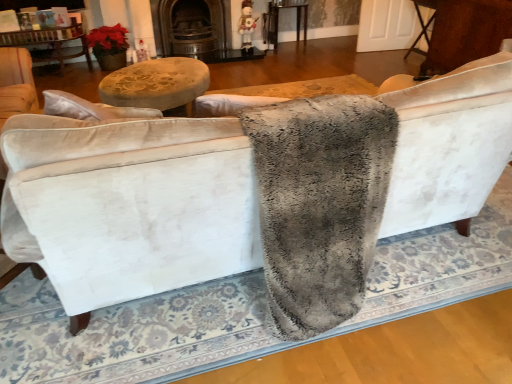
Question: Looking at their shapes, would you say gray fluffy blanket at center is wider or thinner than dark brown wood fireplace at upper center?

Choices:
 (A) thin
 (B) wide

Answer: (B)

Question: Relative to dark brown wood fireplace at upper center, is gray fluffy blanket at center in front or behind?

Choices:
 (A) behind
 (B) front

Answer: (B)

Question: Based on their relative distances, which object is nearer to the dark brown wood fireplace at upper center?

Choices:
 (A) wooden table at center, placed as the 2th table when sorted from front to back
 (B) brown wood table at right, which appears as the 1th table when viewed from the front
 (C) gray fluffy blanket at center

Answer: (A)

Question: Which object is positioned closest to the gray fluffy blanket at center?

Choices:
 (A) brown wood table at right, the second table viewed from the back
 (B) wooden table at center, which is the 2th table from right to left
 (C) dark brown wood fireplace at upper center

Answer: (A)